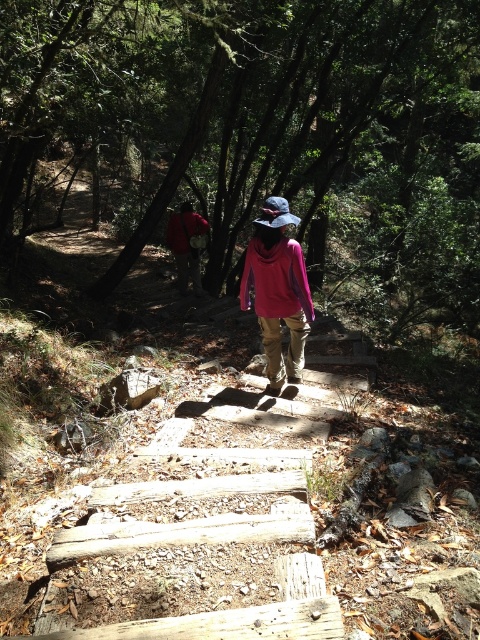
Question: Where is pink matte jacket at center located in relation to red fabric backpack at center in the image?

Choices:
 (A) below
 (B) above

Answer: (A)

Question: Can you confirm if pink matte jacket at center is positioned above red fabric backpack at center?

Choices:
 (A) no
 (B) yes

Answer: (A)

Question: Can you confirm if pink matte jacket at center is positioned to the left of red fabric backpack at center?

Choices:
 (A) yes
 (B) no

Answer: (B)

Question: Which point is farther from the camera taking this photo?

Choices:
 (A) (276, 314)
 (B) (191, 257)

Answer: (B)